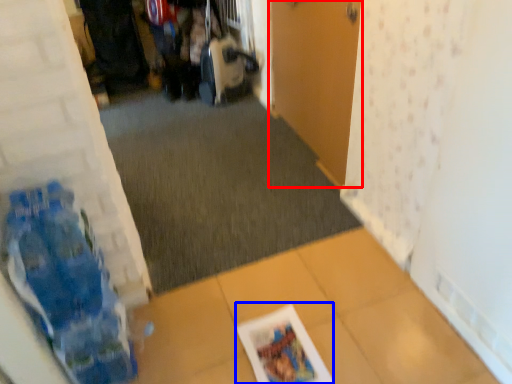
Question: Among these objects, which one is nearest to the camera, door (highlighted by a red box) or magazine (highlighted by a blue box)?

Choices:
 (A) door
 (B) magazine

Answer: (B)